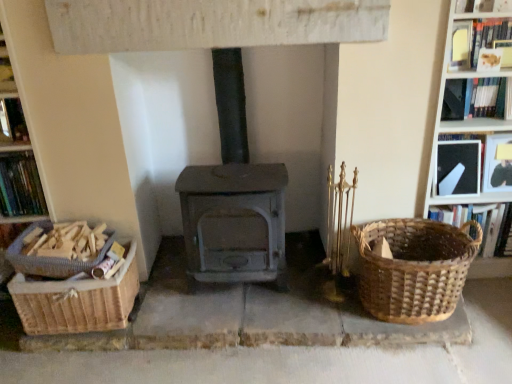
Question: Can you confirm if gray matte wood burning stove at center is positioned to the right of hardcover book at upper right, positioned as the 5th book in right-to-left order?

Choices:
 (A) yes
 (B) no

Answer: (B)

Question: Does gray matte wood burning stove at center have a greater height compared to hardcover book at upper right, placed as the third book when sorted from left to right?

Choices:
 (A) yes
 (B) no

Answer: (A)

Question: From the image's perspective, is gray matte wood burning stove at center located beneath hardcover book at upper right, positioned as the 5th book in right-to-left order?

Choices:
 (A) no
 (B) yes

Answer: (B)

Question: Is gray matte wood burning stove at center next to hardcover book at upper right, placed as the third book when sorted from left to right?

Choices:
 (A) yes
 (B) no

Answer: (B)

Question: Is there a large distance between gray matte wood burning stove at center and hardcover book at upper right, placed as the third book when sorted from left to right?

Choices:
 (A) no
 (B) yes

Answer: (B)

Question: From a real-world perspective, is gray matte wood burning stove at center located higher than hardcover book at upper right, placed as the third book when sorted from left to right?

Choices:
 (A) yes
 (B) no

Answer: (B)

Question: Could you tell me if woven wood basket at left, which is the 1th basket in left-to-right order, is facing woven basket at right, positioned as the 6th book in left-to-right order?

Choices:
 (A) yes
 (B) no

Answer: (B)

Question: Is woven wood basket at left, which is the 1th basket in left-to-right order, positioned before woven basket at right, positioned as the 6th book in left-to-right order?

Choices:
 (A) no
 (B) yes

Answer: (B)

Question: Is woven wood basket at left, which is the 1th basket in left-to-right order, not near woven basket at right, positioned as the 6th book in left-to-right order?

Choices:
 (A) yes
 (B) no

Answer: (A)

Question: Can you confirm if woven wood basket at left, which is the second basket from right to left, is shorter than woven basket at right, which is the second book from right to left?

Choices:
 (A) no
 (B) yes

Answer: (B)

Question: Considering the relative sizes of woven wood basket at left, which is the second basket from right to left, and woven basket at right, which is the second book from right to left, in the image provided, is woven wood basket at left, which is the second basket from right to left, thinner than woven basket at right, which is the second book from right to left,?

Choices:
 (A) yes
 (B) no

Answer: (B)

Question: From a real-world perspective, does woven wood basket at left, which is the 1th basket in left-to-right order, stand above woven basket at right, which is the second book from right to left?

Choices:
 (A) no
 (B) yes

Answer: (B)

Question: Is black paper at upper right, the 3th book when ordered from right to left, in contact with brown woven basket at right, the second basket viewed from the left?

Choices:
 (A) yes
 (B) no

Answer: (B)